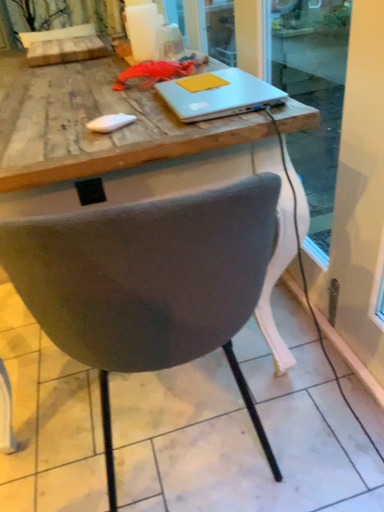
Image resolution: width=384 pixels, height=512 pixels. In order to click on free space in front of yellow matte notepad at upper center in this screenshot , I will do `click(211, 98)`.